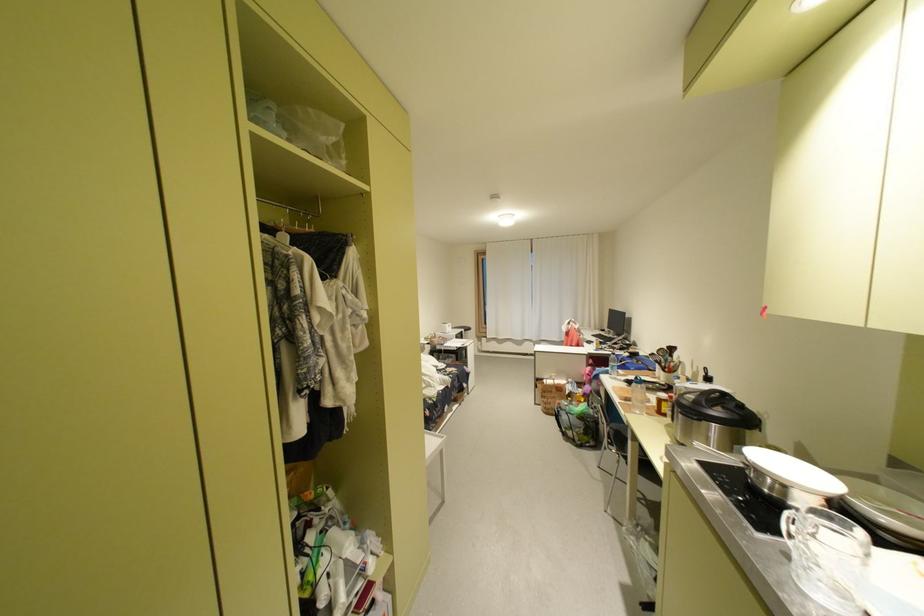
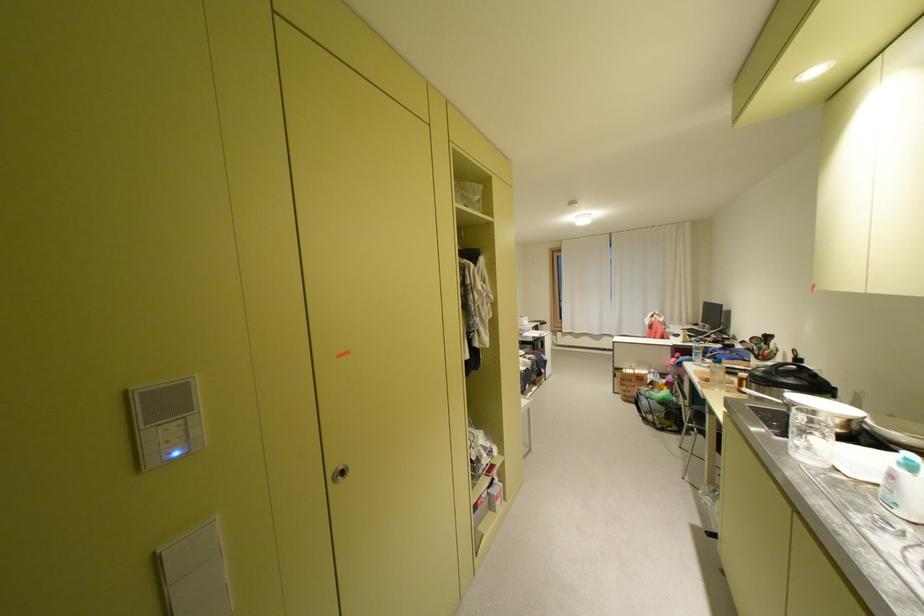
Locate, in the second image, the point that corresponds to (770,530) in the first image.

(789, 436)